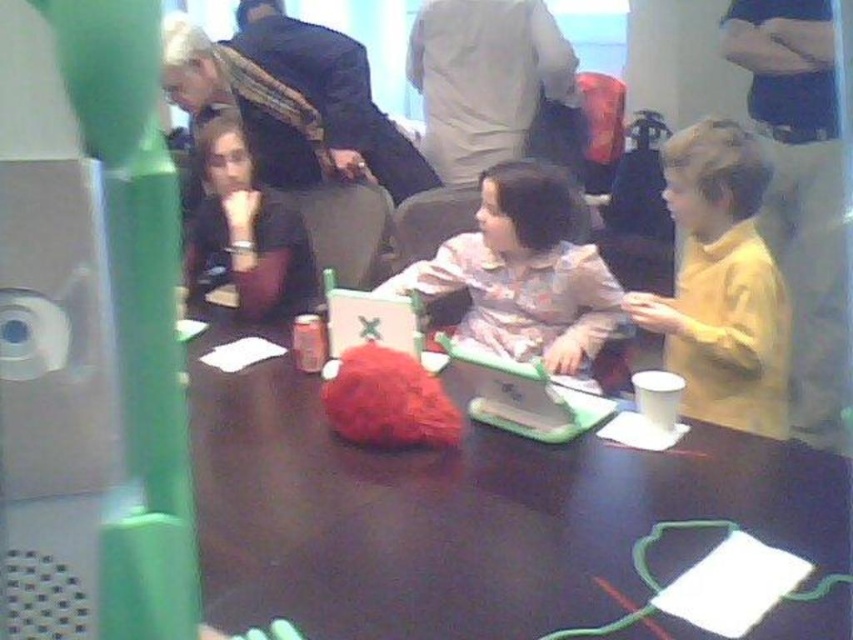
Is shiny brown table at center positioned before matte black shirt at left?

That is True.

Image resolution: width=853 pixels, height=640 pixels. What do you see at coordinates (461, 515) in the screenshot?
I see `shiny brown table at center` at bounding box center [461, 515].

I want to click on shiny brown table at center, so click(461, 515).

How far apart are yellow matte shirt at right and fluffy pink sweater at center?

They are 14.37 inches apart.

Locate an element on the screen. The width and height of the screenshot is (853, 640). yellow matte shirt at right is located at coordinates (722, 284).

Find the location of a particular element. yellow matte shirt at right is located at coordinates (722, 284).

Locate an element on the screen. yellow matte shirt at right is located at coordinates (722, 284).

Measure the distance from shiny brown table at center to fluffy pink sweater at center.

shiny brown table at center and fluffy pink sweater at center are 24.83 inches apart from each other.

Does shiny brown table at center appear under fluffy pink sweater at center?

Indeed, shiny brown table at center is positioned under fluffy pink sweater at center.

Between point (776, 536) and point (560, 257), which one is positioned in front?

Point (776, 536)

Where is `shiny brown table at center`? shiny brown table at center is located at coordinates (461, 515).